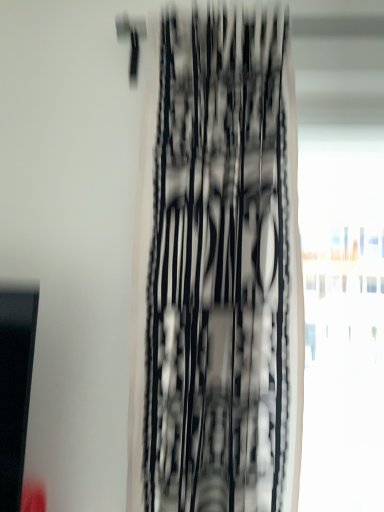
Question: Considering the positions of point [352, 166] and point [203, 440], is point [352, 166] closer or farther from the camera than point [203, 440]?

Choices:
 (A) farther
 (B) closer

Answer: (A)

Question: From their relative heights in the image, would you say transparent glass window at right is taller or shorter than black mesh curtain at center?

Choices:
 (A) tall
 (B) short

Answer: (B)

Question: Would you say transparent glass window at right is inside or outside black mesh curtain at center?

Choices:
 (A) outside
 (B) inside

Answer: (A)

Question: Looking at their shapes, would you say black mesh curtain at center is wider or thinner than transparent glass window at right?

Choices:
 (A) wide
 (B) thin

Answer: (A)

Question: From the image's perspective, is black mesh curtain at center above or below transparent glass window at right?

Choices:
 (A) above
 (B) below

Answer: (A)

Question: From a real-world perspective, is black mesh curtain at center above or below transparent glass window at right?

Choices:
 (A) below
 (B) above

Answer: (B)

Question: In the image, is black mesh curtain at center positioned in front of or behind transparent glass window at right?

Choices:
 (A) behind
 (B) front

Answer: (B)